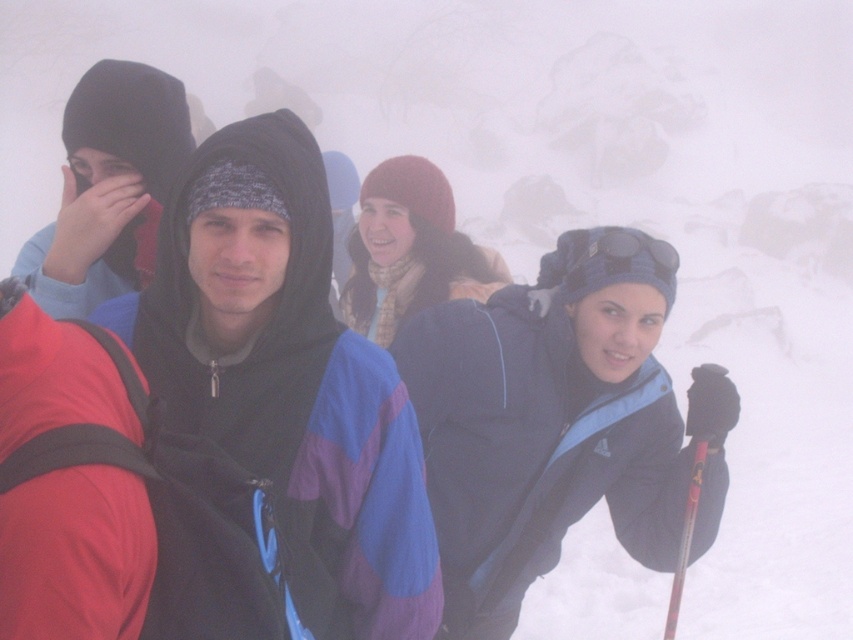
You are a photographer trying to capture a clear shot of both the blue fleece jacket at center and the matte black hoodie at left in the foggy scene. Which one will appear more clearly in your photo?

The blue fleece jacket at center will appear more clearly in the photo because it is closer to the viewer than the matte black hoodie at left, which is further away in the foggy environment.

You are a photographer trying to capture a clear shot of the matte black hoodie at left and the red plastic ski pole at lower right. Since the scene is foggy, you decide to move closer to reduce the fog between you and the subjects. Which object should you move closer to first to ensure both are in focus?

You should move closer to the matte black hoodie at left first because it is positioned to the left of the red plastic ski pole at lower right, so it is closer to your current position. By focusing on the closer object first, you can adjust your camera settings to ensure both are in focus as you move closer.